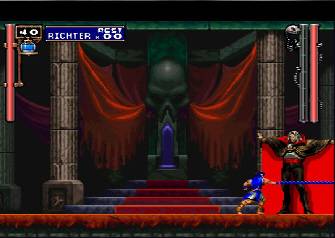
The width and height of the screenshot is (335, 238). In order to click on bottom of pilar in this screenshot , I will do `click(71, 194)`.